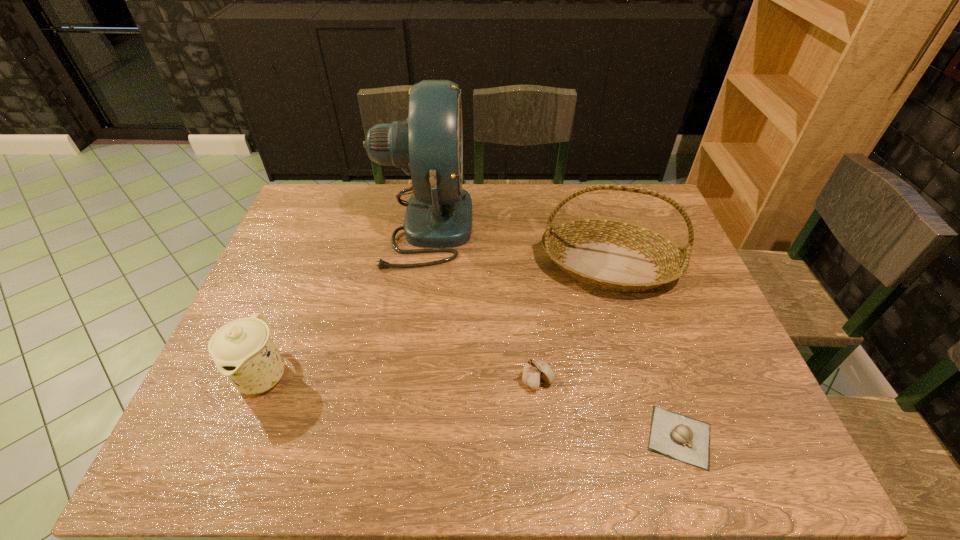
This screenshot has height=540, width=960. Find the location of `the tallest object`. the tallest object is located at coordinates (428, 146).

Where is `fan`? This screenshot has width=960, height=540. fan is located at coordinates (428, 146).

Find the location of `the fourth shortest object`. the fourth shortest object is located at coordinates (616, 255).

You are a GUI agent. You are given a task and a screenshot of the screen. Output one action in this format:
    pyautogui.click(x=<x>, y=<y>)
    Task: Click on the chinaware
    The image size is (960, 540).
    Given the screenshot: What is the action you would take?
    pyautogui.click(x=243, y=350)

Identify the location of the leftmost object. (243, 350).

Identify the location of the third object from left to right. (536, 372).

The height and width of the screenshot is (540, 960). I want to click on the taller garlic, so click(x=536, y=372).

Locate an element on the screen. The image size is (960, 540). the right garlic is located at coordinates (674, 435).

This screenshot has height=540, width=960. I want to click on the nearer garlic, so click(674, 435).

At what (x,y) coordinates should I click in order to perform the action: click on vacant space located 0.290m in front of the tallest object to blow air. Please return your answer as a coordinate pair (x, y). This screenshot has width=960, height=540. Looking at the image, I should click on (563, 225).